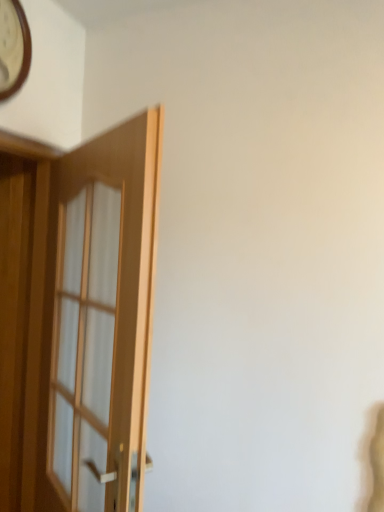
Question: From a real-world perspective, is light brown wooden door at left physically located above or below wooden clock at upper left?

Choices:
 (A) above
 (B) below

Answer: (B)

Question: Is light brown wooden door at left taller or shorter than wooden clock at upper left?

Choices:
 (A) short
 (B) tall

Answer: (B)

Question: In the image, is light brown wooden door at left positioned in front of or behind wooden clock at upper left?

Choices:
 (A) behind
 (B) front

Answer: (B)

Question: Looking at their shapes, would you say wooden clock at upper left is wider or thinner than light brown wooden door at left?

Choices:
 (A) thin
 (B) wide

Answer: (A)

Question: Is wooden clock at upper left situated inside light brown wooden door at left or outside?

Choices:
 (A) inside
 (B) outside

Answer: (B)

Question: Considering the relative positions of wooden clock at upper left and light brown wooden door at left in the image provided, is wooden clock at upper left to the left or to the right of light brown wooden door at left?

Choices:
 (A) left
 (B) right

Answer: (A)

Question: Is wooden clock at upper left in front of or behind light brown wooden door at left in the image?

Choices:
 (A) front
 (B) behind

Answer: (B)